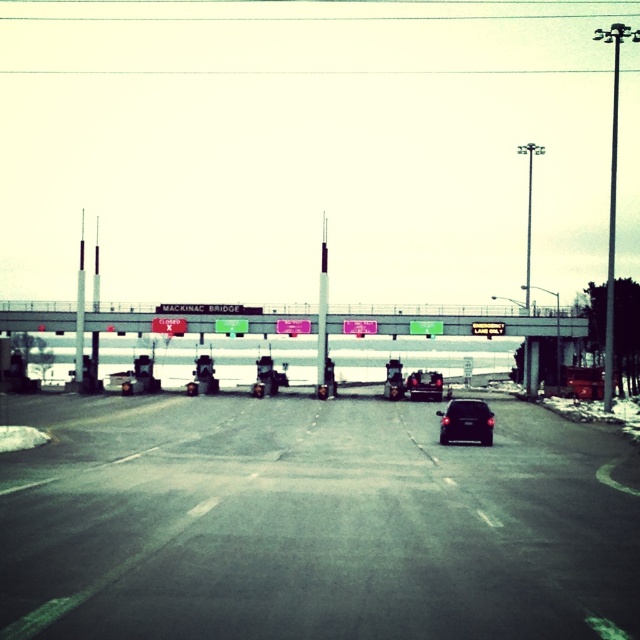
You are a traffic controller monitoring the toll booth area at the Mackinac Bridge. You notice two cars labeled as matte black car at center and black matte car at center in the scene. According to the description, which car is positioned higher in the image?

The matte black car at center is located above the black matte car at center, so the matte black car at center is positioned higher in the image.

You are a traffic controller at the Mackinac Bridge toll booth. You need to determine if the matte black car at center is within the 100 feet safety zone required for emergency braking. Can you confirm?

The matte black car at center and camera are 101.51 feet apart from each other, which exceeds the 100 feet safety zone. Therefore, the matte black car at center is outside the required safety zone for emergency braking.